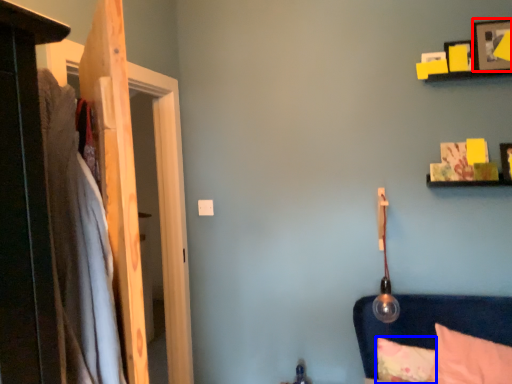
Question: Which object is closer to the camera taking this photo, picture frame (highlighted by a red box) or pillow (highlighted by a blue box)?

Choices:
 (A) picture frame
 (B) pillow

Answer: (A)